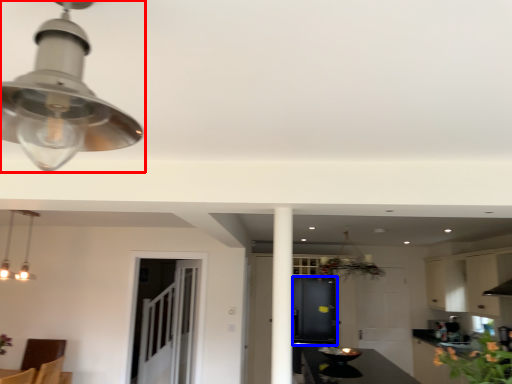
Question: Which of the following is the closest to the observer, lamp (highlighted by a red box) or cabinetry (highlighted by a blue box)?

Choices:
 (A) lamp
 (B) cabinetry

Answer: (A)